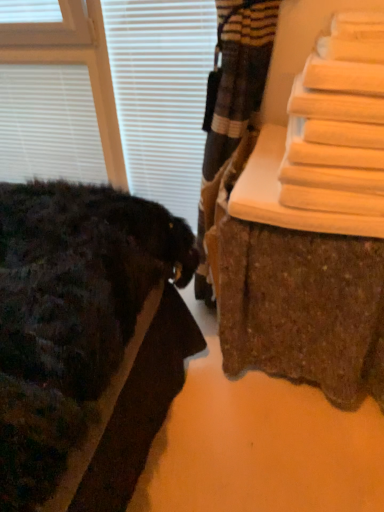
Question: Is white matte blind at upper left, positioned as the 1th blind in right-to-left order, directly adjacent to wooden bench at right?

Choices:
 (A) no
 (B) yes

Answer: (A)

Question: Is white matte blind at upper left, positioned as the 1th blind in right-to-left order, taller than wooden bench at right?

Choices:
 (A) no
 (B) yes

Answer: (B)

Question: From the image's perspective, is white matte blind at upper left, marked as the 2th blind in a left-to-right arrangement, over wooden bench at right?

Choices:
 (A) yes
 (B) no

Answer: (A)

Question: Can you confirm if white matte blind at upper left, positioned as the 1th blind in right-to-left order, is wider than wooden bench at right?

Choices:
 (A) no
 (B) yes

Answer: (A)

Question: Is wooden bench at right at the back of white matte blind at upper left, marked as the 2th blind in a left-to-right arrangement?

Choices:
 (A) yes
 (B) no

Answer: (B)

Question: Could you tell me if white matte blind at upper left, positioned as the 1th blind in right-to-left order, is facing wooden bench at right?

Choices:
 (A) no
 (B) yes

Answer: (A)

Question: Can you confirm if white matte blinds at upper left, which is the first blind from left to right, is positioned to the right of white matte blind at upper left, marked as the 2th blind in a left-to-right arrangement?

Choices:
 (A) yes
 (B) no

Answer: (B)

Question: Is white matte blinds at upper left, which is the first blind from left to right, surrounding white matte blind at upper left, marked as the 2th blind in a left-to-right arrangement?

Choices:
 (A) no
 (B) yes

Answer: (A)

Question: Is white matte blinds at upper left, placed as the 2th blind when sorted from right to left, beside white matte blind at upper left, marked as the 2th blind in a left-to-right arrangement?

Choices:
 (A) no
 (B) yes

Answer: (A)

Question: From the image's perspective, is white matte blinds at upper left, which is the first blind from left to right, on white matte blind at upper left, marked as the 2th blind in a left-to-right arrangement?

Choices:
 (A) no
 (B) yes

Answer: (B)

Question: Could you tell me if white matte blinds at upper left, placed as the 2th blind when sorted from right to left, is turned towards white matte blind at upper left, marked as the 2th blind in a left-to-right arrangement?

Choices:
 (A) no
 (B) yes

Answer: (A)

Question: From a real-world perspective, is white matte blinds at upper left, which is the first blind from left to right, under white matte blind at upper left, positioned as the 1th blind in right-to-left order?

Choices:
 (A) yes
 (B) no

Answer: (A)

Question: Considering the relative sizes of white matte blind at upper left, positioned as the 1th blind in right-to-left order, and white matte blinds at upper left, placed as the 2th blind when sorted from right to left, in the image provided, is white matte blind at upper left, positioned as the 1th blind in right-to-left order, smaller than white matte blinds at upper left, placed as the 2th blind when sorted from right to left,?

Choices:
 (A) no
 (B) yes

Answer: (A)